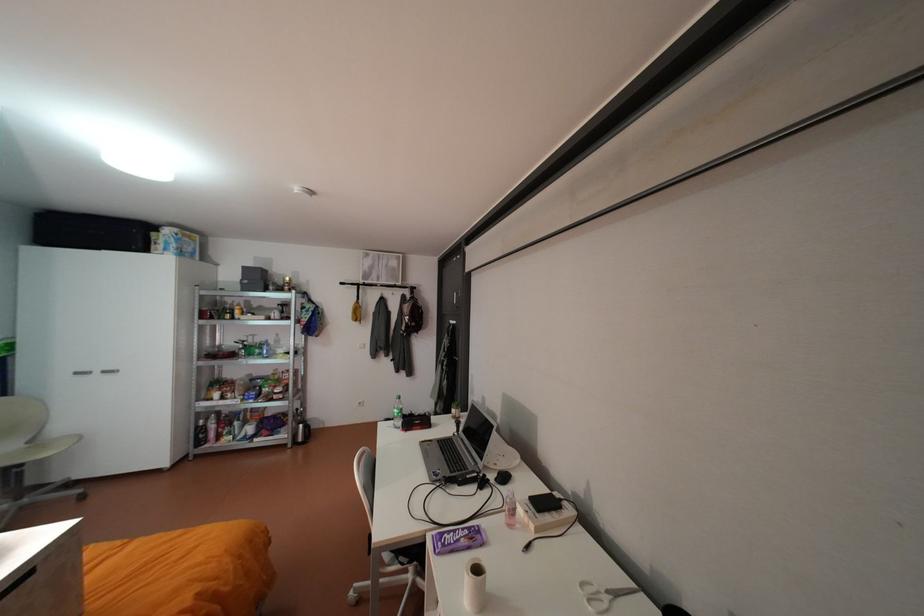
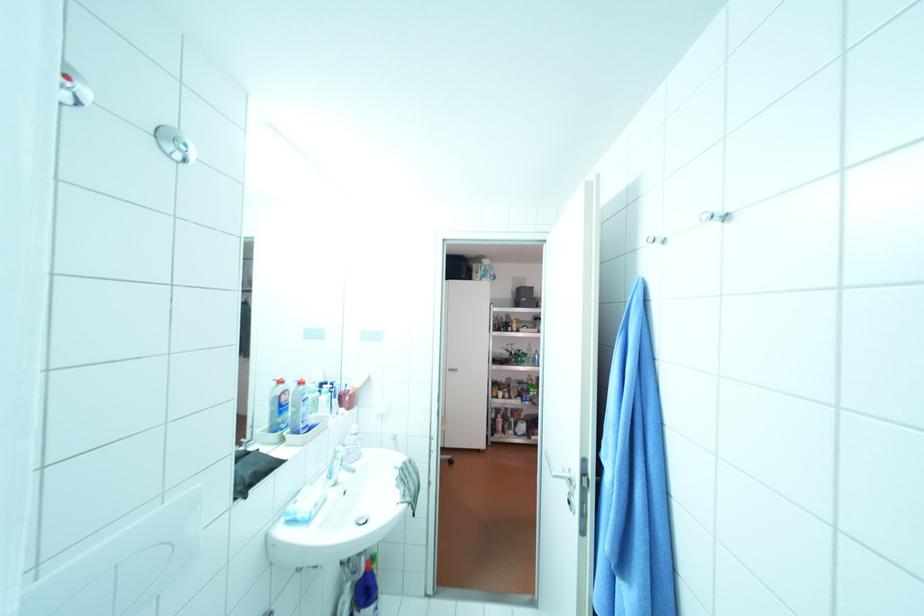
Question: Which direction would the cameraman need to move to produce the second image? Reply with the corresponding letter.

Choices:
 (A) Left
 (B) Right
 (C) Forward
 (D) Backward

Answer: (A)